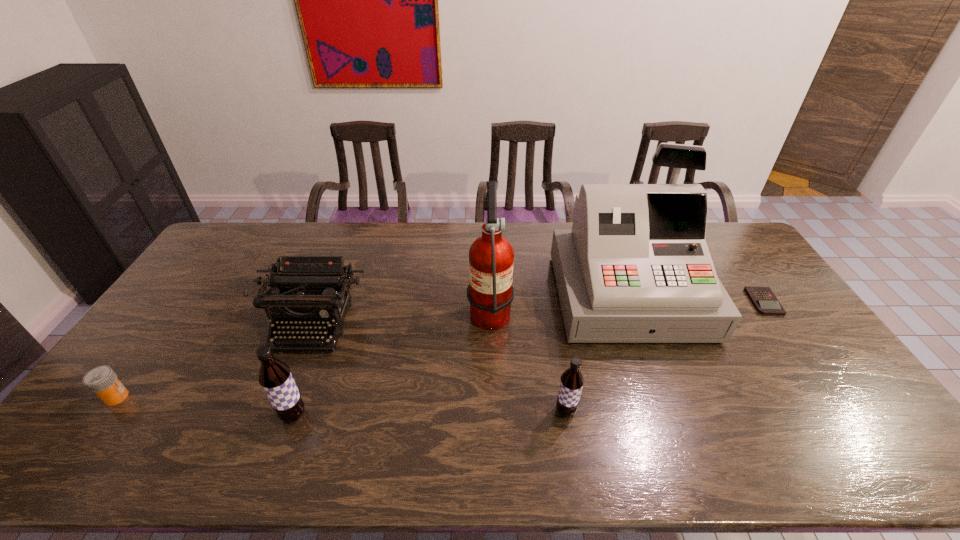
Find the location of a particular element. The height and width of the screenshot is (540, 960). the left root beer is located at coordinates (275, 377).

Where is `the fifth shortest object`? This screenshot has height=540, width=960. the fifth shortest object is located at coordinates (275, 377).

Image resolution: width=960 pixels, height=540 pixels. I want to click on the right root beer, so click(x=572, y=381).

You are a GUI agent. You are given a task and a screenshot of the screen. Output one action in this format:
    pyautogui.click(x=<x>, y=<y>)
    Task: Click on the shorter root beer
    The height and width of the screenshot is (540, 960).
    Given the screenshot: What is the action you would take?
    pyautogui.click(x=572, y=381)

Identify the location of the rightmost object. (763, 299).

You are a GUI agent. You are given a task and a screenshot of the screen. Output one action in this format:
    pyautogui.click(x=<x>, y=<y>)
    Task: Click on the shortest object
    This screenshot has width=960, height=540.
    Given the screenshot: What is the action you would take?
    pyautogui.click(x=763, y=299)

What are the coordinates of `fire extinguisher` in the screenshot? It's located at coord(490,292).

Locate an element on the screen. The image size is (960, 540). the second object from right to left is located at coordinates (635, 268).

The width and height of the screenshot is (960, 540). I want to click on the leftmost object, so click(102, 380).

Where is `medicine`? The height and width of the screenshot is (540, 960). medicine is located at coordinates (102, 380).